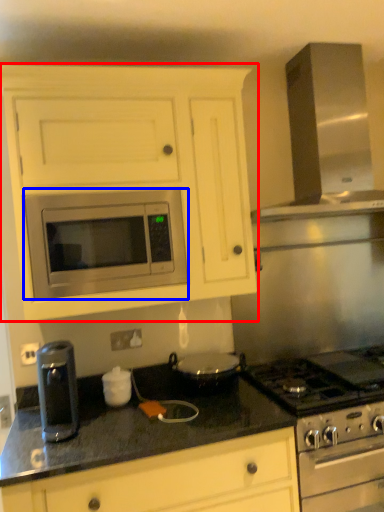
Question: Among these objects, which one is nearest to the camera, cabinetry (highlighted by a red box) or microwave oven (highlighted by a blue box)?

Choices:
 (A) cabinetry
 (B) microwave oven

Answer: (A)